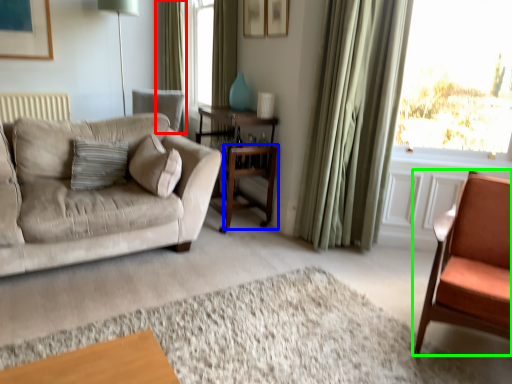
Question: Considering the real-world distances, which object is farthest from curtain (highlighted by a red box)? table (highlighted by a blue box) or chair (highlighted by a green box)?

Choices:
 (A) table
 (B) chair

Answer: (B)